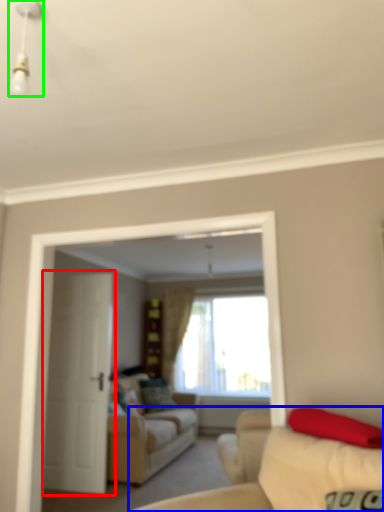
Question: Based on their relative distances, which object is nearer to door (highlighted by a red box)? Choose from studio couch (highlighted by a blue box) and light fixture (highlighted by a green box).

Choices:
 (A) studio couch
 (B) light fixture

Answer: (A)